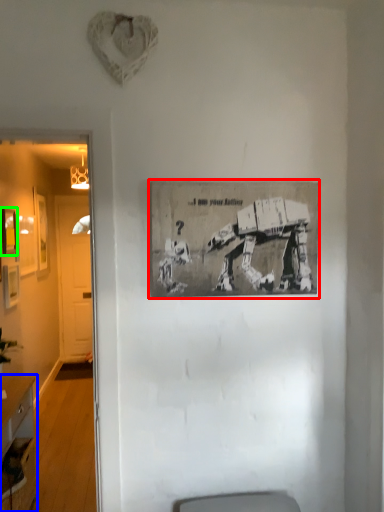
Question: Estimate the real-world distances between objects in this image. Which object is farther from picture frame (highlighted by a red box), desk (highlighted by a blue box) or picture frame (highlighted by a green box)?

Choices:
 (A) desk
 (B) picture frame

Answer: (B)